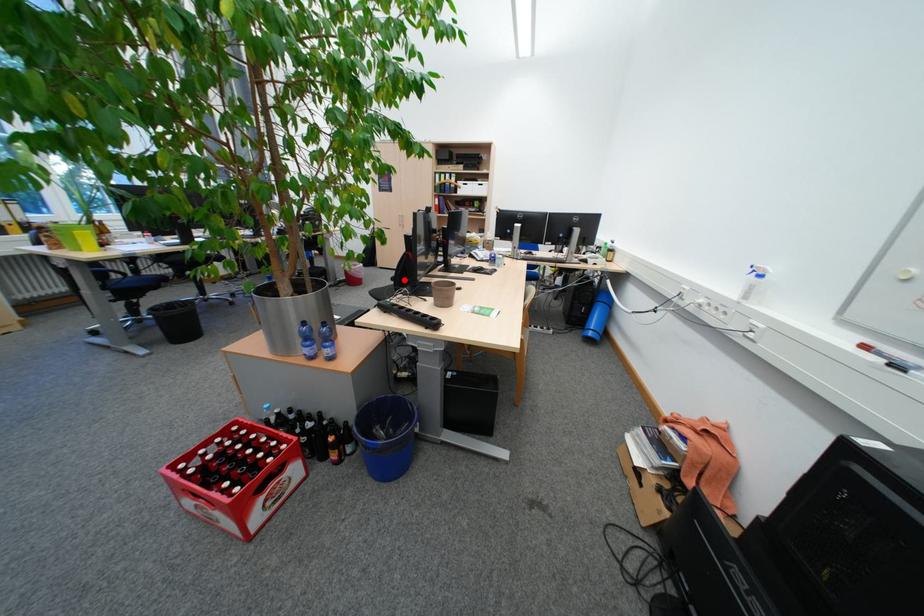
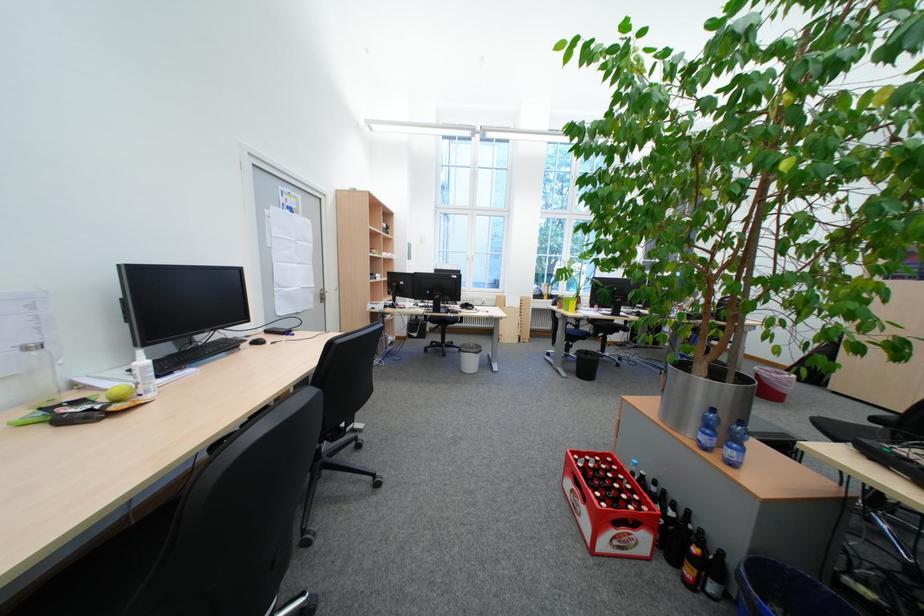
Question: I am providing you with two images of the same scene from different viewpoints. In image1, a red point is highlighted. Considering the same 3D point in image2, which of the following is correct?

Choices:
 (A) It is closer
 (B) It is farther

Answer: (A)